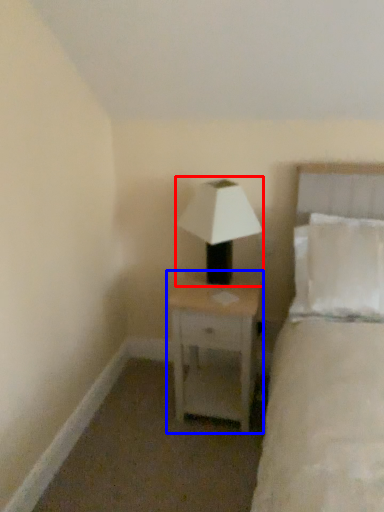
Question: Which object appears closest to the camera in this image, lamp (highlighted by a red box) or nightstand (highlighted by a blue box)?

Choices:
 (A) lamp
 (B) nightstand

Answer: (A)